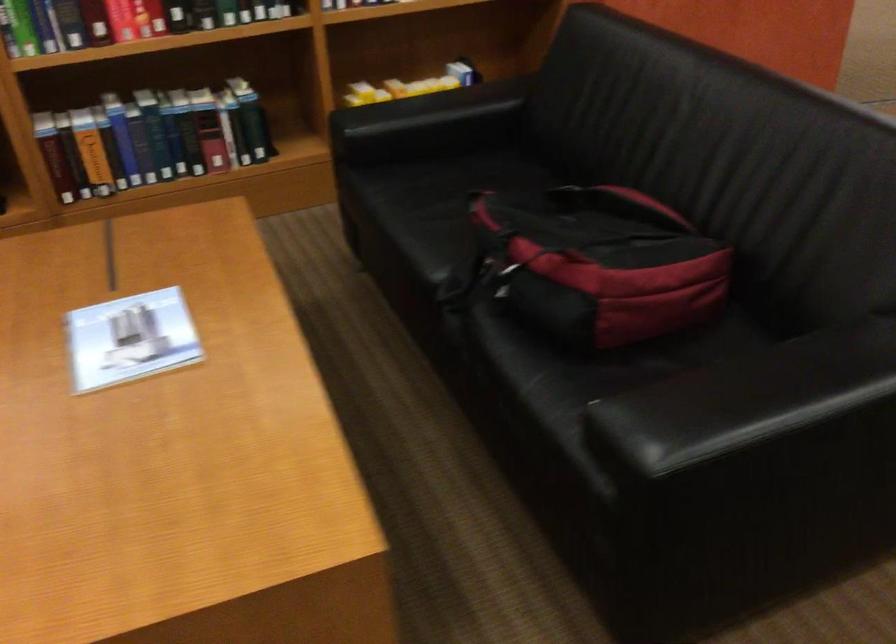
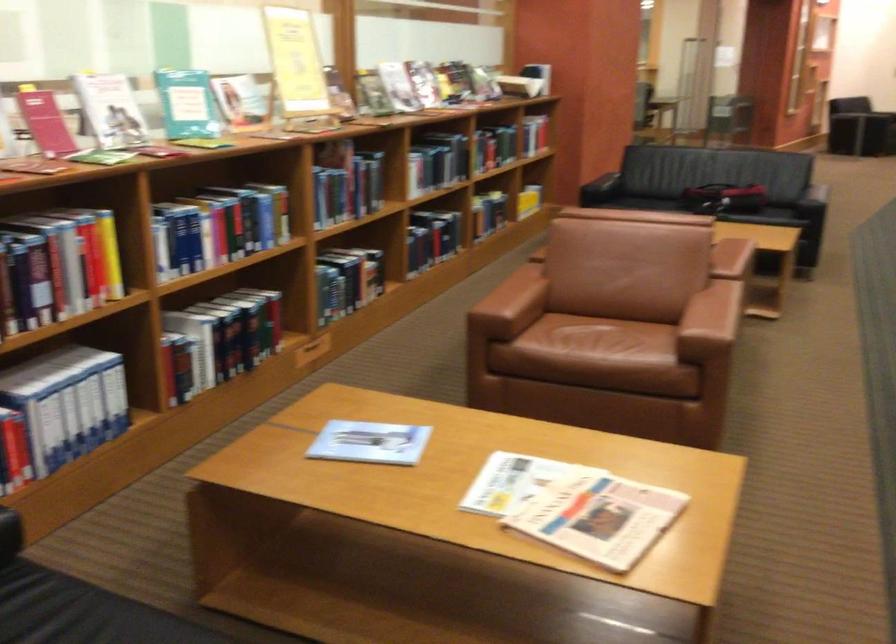
Question: I am providing you with two images of the same scene from different viewpoints. Which of the following objects are not visible in image2?

Choices:
 (A) small white booklet
 (B) blue booklet
 (C) sofa armrest
 (D) shark plush toy

Answer: (A)